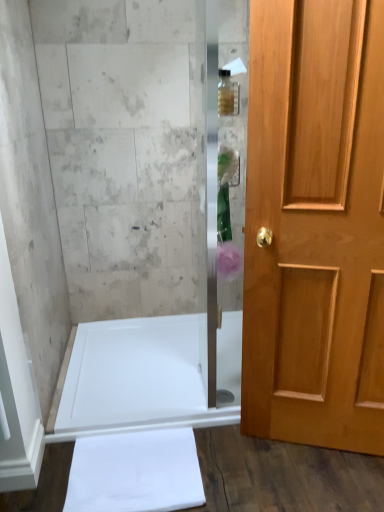
Question: Relative to translucent glass bottle at upper center, is white glossy bathtub at lower left in front or behind?

Choices:
 (A) front
 (B) behind

Answer: (B)

Question: Considering the positions of white glossy bathtub at lower left and translucent glass bottle at upper center in the image, is white glossy bathtub at lower left bigger or smaller than translucent glass bottle at upper center?

Choices:
 (A) big
 (B) small

Answer: (A)

Question: Estimate the real-world distances between objects in this image. Which object is farther from the white glossy bathtub at lower left?

Choices:
 (A) translucent pink flower at center
 (B) light brown wooden door at right
 (C) translucent glass bottle at upper center

Answer: (C)

Question: Which object is positioned closest to the light brown wooden door at right?

Choices:
 (A) white glossy bathtub at lower left
 (B) translucent glass bottle at upper center
 (C) translucent pink flower at center

Answer: (C)